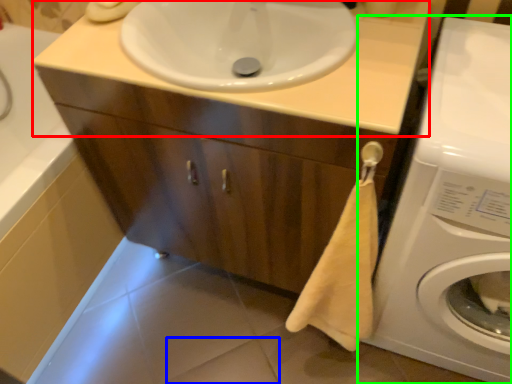
Question: Based on their relative distances, which object is farther from counter top (highlighted by a red box)? Choose from tile (highlighted by a blue box) and washing machine (highlighted by a green box).

Choices:
 (A) tile
 (B) washing machine

Answer: (A)